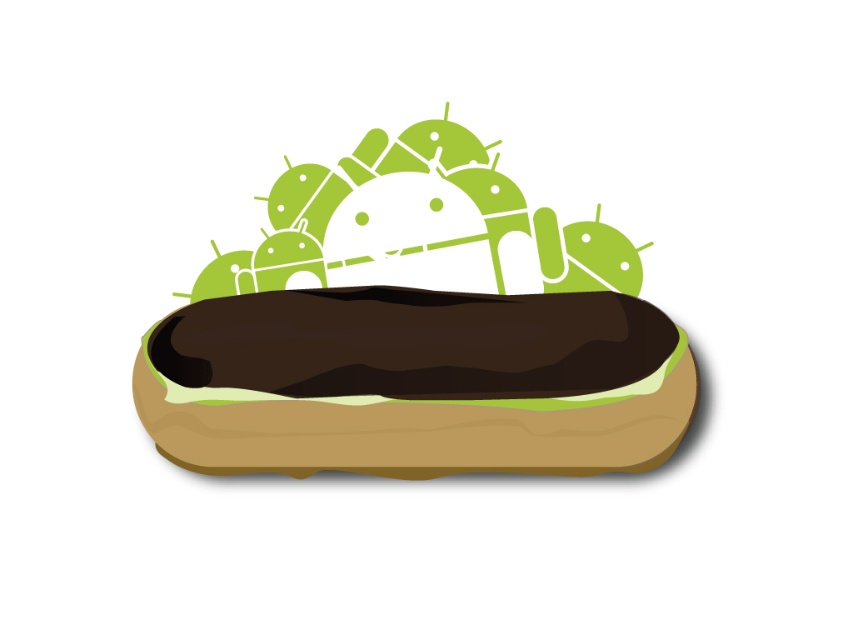
Between brown matte hot dog at center and green matte androids at upper center, which one is positioned lower?

Positioned lower is brown matte hot dog at center.

Is brown matte hot dog at center taller than green matte androids at upper center?

Incorrect, brown matte hot dog at center's height is not larger of green matte androids at upper center's.

Identify the location of brown matte hot dog at center. This screenshot has height=640, width=853. (415, 384).